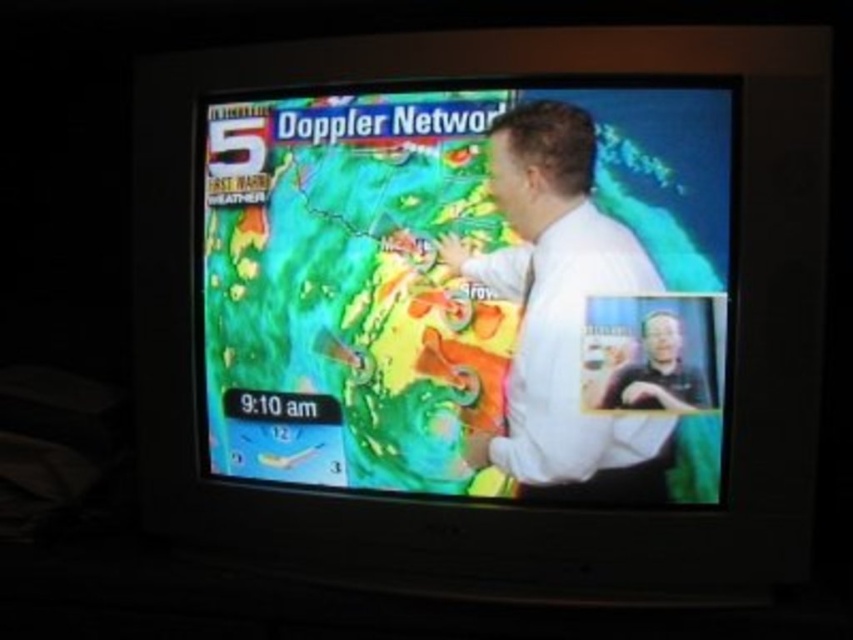
Which is behind, point (512, 348) or point (476, 433)?

The point (476, 433) is behind.

Between rainbow-colored weather map at center and white smooth shirt at center, which one is positioned higher?

Positioned higher is rainbow-colored weather map at center.

I want to click on rainbow-colored weather map at center, so click(x=469, y=291).